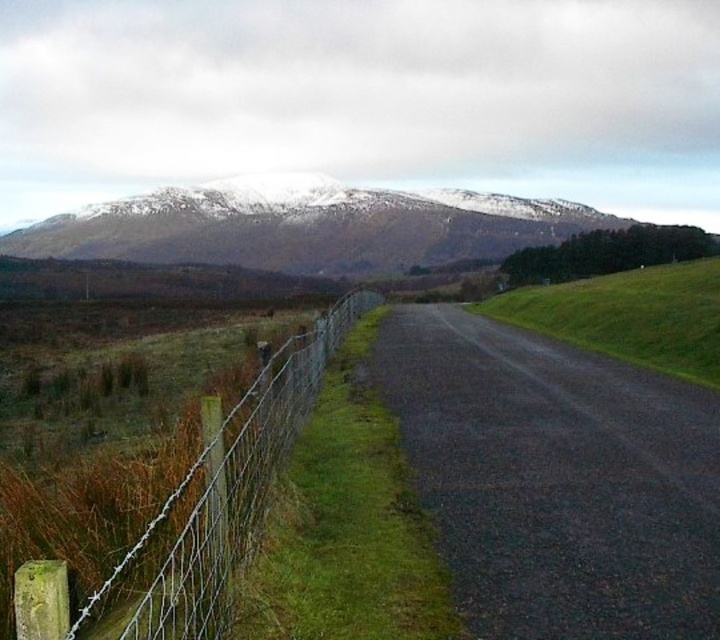
Question: Which object is closer to the camera taking this photo?

Choices:
 (A) snow-covered mountain at upper center
 (B) wire mesh fence at left

Answer: (B)

Question: Does snow-covered mountain at upper center have a greater width compared to wire mesh fence at left?

Choices:
 (A) no
 (B) yes

Answer: (B)

Question: Can you confirm if snow-covered mountain at upper center is thinner than wire mesh fence at left?

Choices:
 (A) no
 (B) yes

Answer: (A)

Question: Can you confirm if snow-covered mountain at upper center is positioned to the left of wire mesh fence at left?

Choices:
 (A) no
 (B) yes

Answer: (B)

Question: Which of the following is the closest to the observer?

Choices:
 (A) wire mesh fence at left
 (B) snow-covered mountain at upper center

Answer: (A)